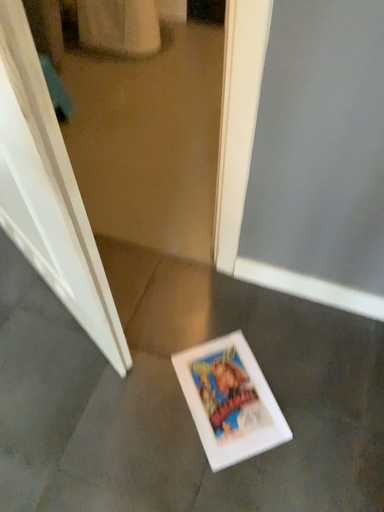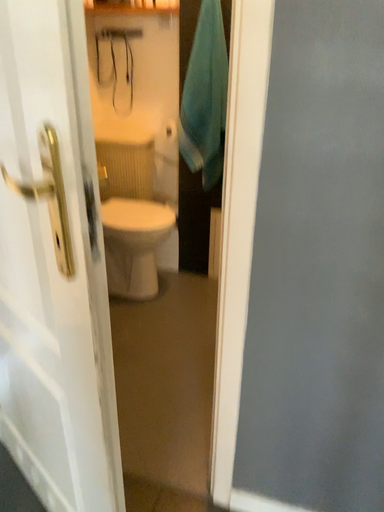
Question: How did the camera likely rotate when shooting the video?

Choices:
 (A) rotated upward
 (B) rotated downward

Answer: (A)